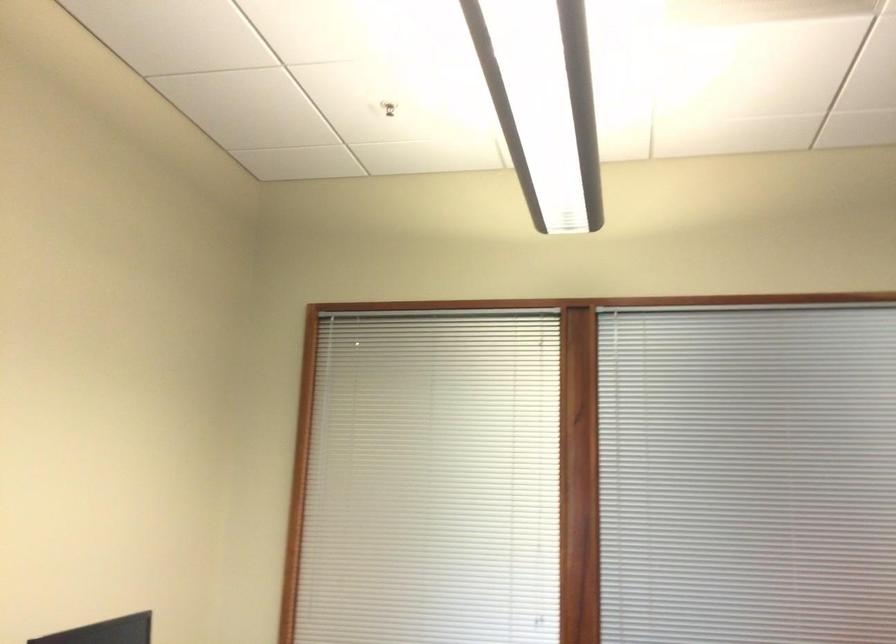
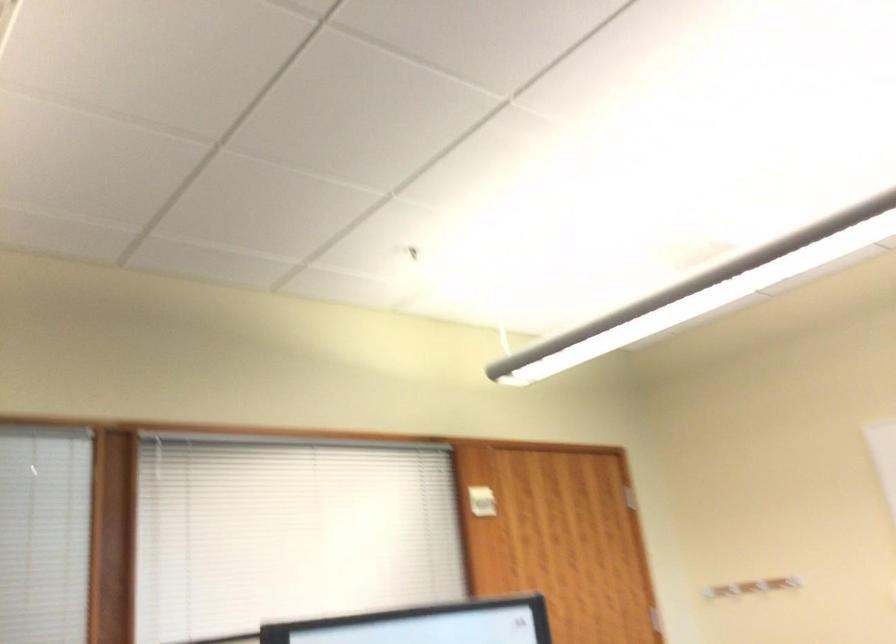
Question: The camera is either moving clockwise (left) or counter-clockwise (right) around the object. The first image is from the beginning of the video and the second image is from the end. Is the camera moving left or right when shooting the video?

Choices:
 (A) Left
 (B) Right

Answer: (A)